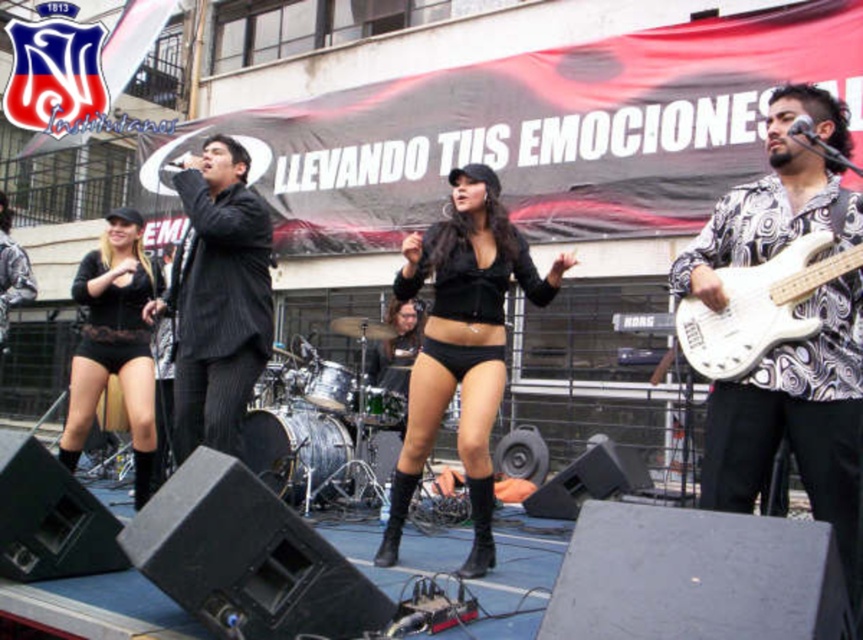
You are standing at the black matte shorts at center and want to throw a small object to a friend who is standing 5 meters away from you. Is your friend within reach?

The distance between you and your friend is 5 meters, which is less than the 6.12 meters between you and the viewer. However, the question does not specify the maximum throwing distance. Assuming typical human throwing capabilities, 5 meters is achievable, so yes, your friend is within reach.

You are a photographer at the event and want to capture a photo of both the black lace shorts at lower left and the white glossy electric guitar at right. Based on their positions, which object is closer to the left edge of the photo?

The black lace shorts at lower left is to the left of the white glossy electric guitar at right, so it is closer to the left edge of the photo.

You are a photographer positioned at the back of the audience. You want to capture a photo where the black matte shorts at center and the white glossy electric guitar at right are both clearly visible. Considering their heights, which object will appear larger in the photo?

The black matte shorts at center will appear larger in the photo because it is taller than the white glossy electric guitar at right.